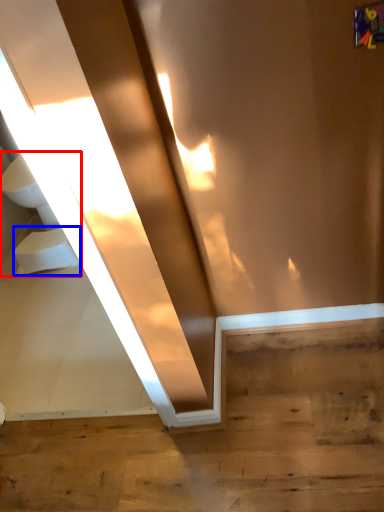
Question: Which point is further to the camera, sink (highlighted by a red box) or toilet bowl (highlighted by a blue box)?

Choices:
 (A) sink
 (B) toilet bowl

Answer: (A)